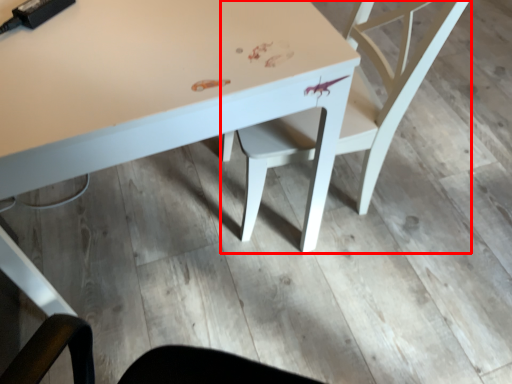
Question: From the image, what is the correct spatial relationship of chair (annotated by the red box) in relation to table?

Choices:
 (A) right
 (B) left

Answer: (A)